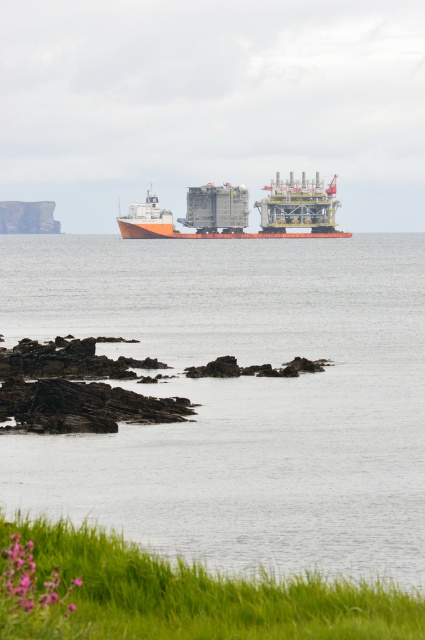
You are a marine biologist studying the coastal area. You notice the clear water at center and the orange matte cargo ship at center. Which of these two has a greater width in the image?

The clear water at center has a greater width than the orange matte cargo ship at center according to the description.